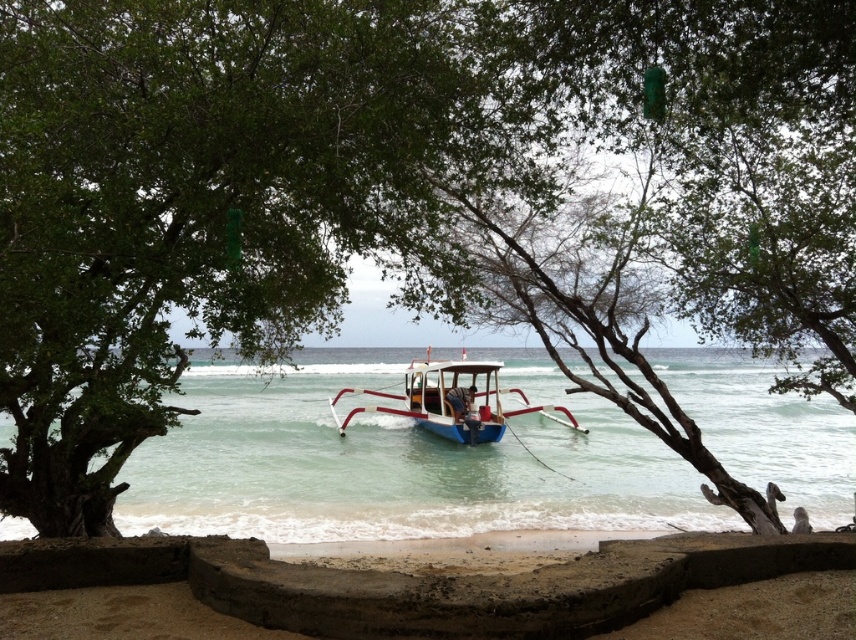
Question: In this image, where is blue water at center located relative to blue painted wood boat at center?

Choices:
 (A) above
 (B) below

Answer: (B)

Question: Is blue water at center bigger than blue painted wood boat at center?

Choices:
 (A) yes
 (B) no

Answer: (A)

Question: Is blue water at center to the right of blue painted wood boat at center from the viewer's perspective?

Choices:
 (A) yes
 (B) no

Answer: (A)

Question: Which object appears closest to the camera in this image?

Choices:
 (A) blue water at center
 (B) blue painted wood boat at center

Answer: (A)